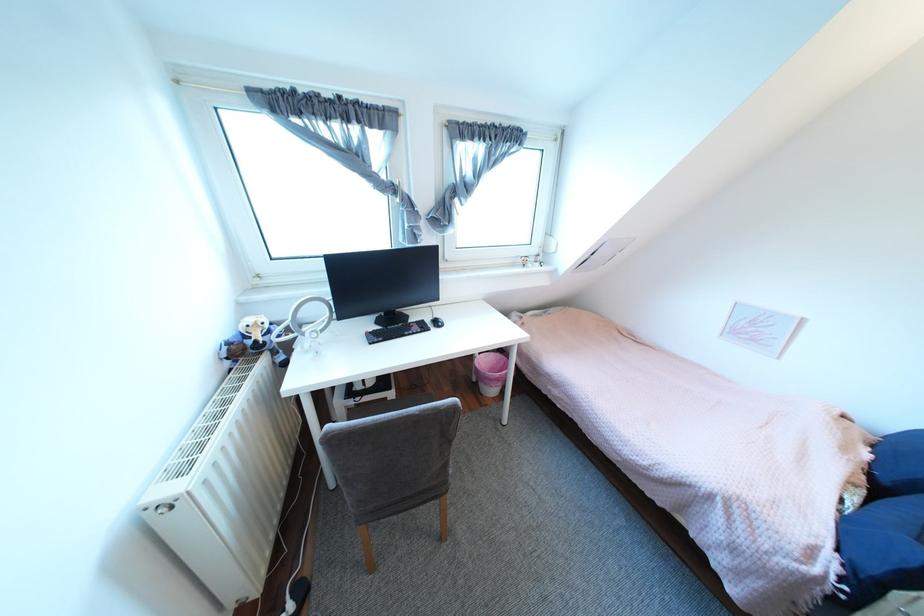
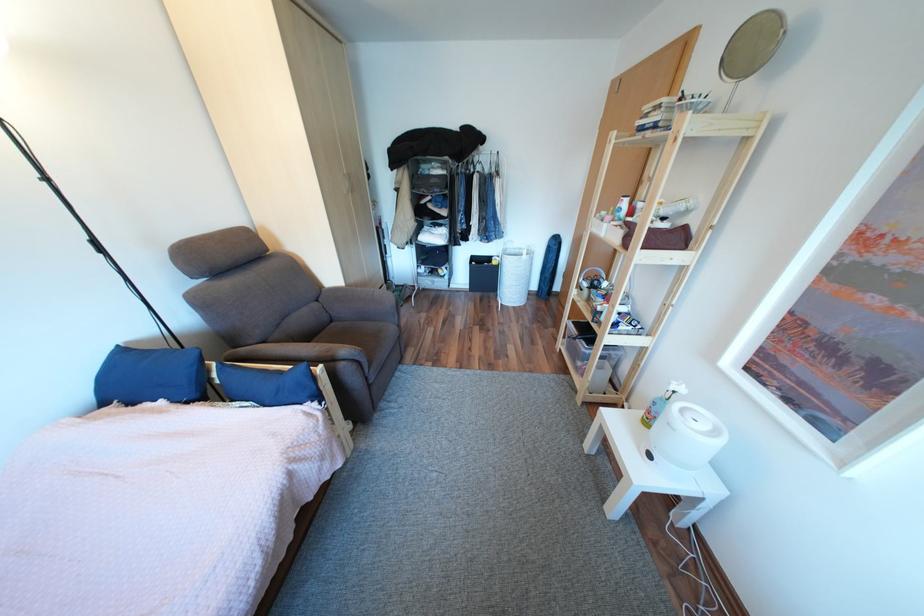
In the second image, find the point that corresponds to pixel 896 482 in the first image.

(205, 395)